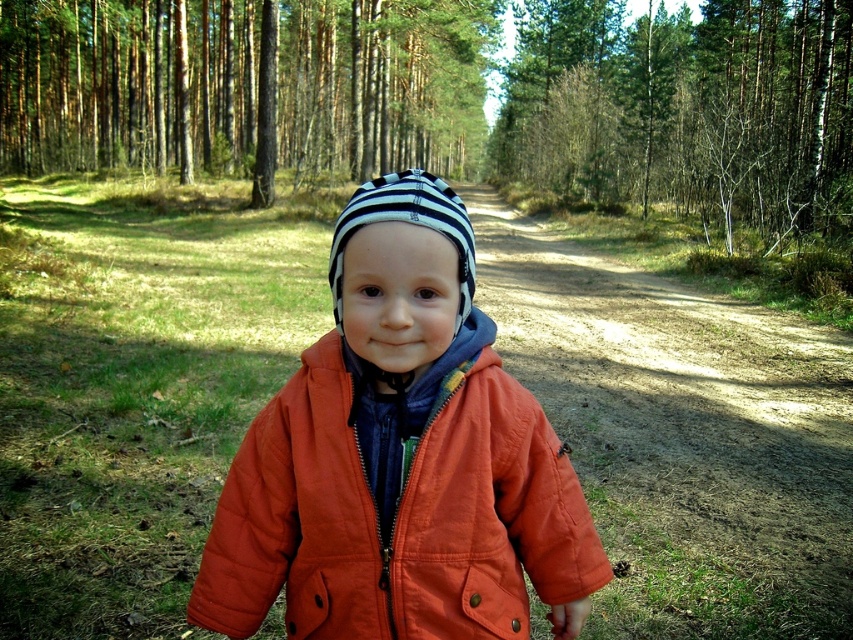
You are a hiker who wants to take a photo of the smooth brown tree trunk at center. You are currently standing at the point marked as point (244, 84). Is the tree trunk in front of you or behind you?

The smooth brown tree trunk at center is located at point (244, 84), which is where you are standing. Therefore, you are right at the tree trunk and it is neither in front nor behind you.

You are a hiker who needs to reach a tree trunk that is 3 meters in diameter. You see the orange quilted jacket at center and the smooth brown tree trunk at center. Which object is closer to you?

The orange quilted jacket at center is 33.42 meters away from the smooth brown tree trunk at center. Since the tree trunk is 3 meters in diameter, the distance between them is much larger than the tree trunk size. However, the question asks which object is closer to you. Without knowing your exact position, we can only state the distance between them. Therefore, it is impossible to determine which is closer to you based on the given information.